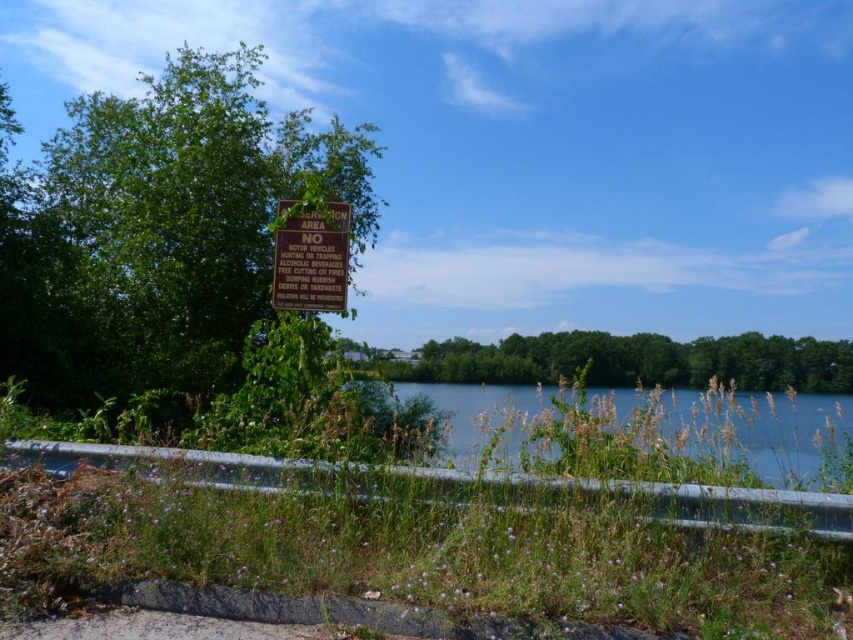
Question: Is green leafy trees at center further to the viewer compared to brown wooden sign at upper center?

Choices:
 (A) yes
 (B) no

Answer: (A)

Question: Can you confirm if green leafy trees at center is bigger than brown wooden sign at upper center?

Choices:
 (A) no
 (B) yes

Answer: (B)

Question: Estimate the real-world distances between objects in this image. Which object is closer to the green leafy tree at upper left?

Choices:
 (A) clear water at center
 (B) brown wooden sign at upper center

Answer: (B)

Question: Is clear water at center to the left of green leafy trees at center from the viewer's perspective?

Choices:
 (A) yes
 (B) no

Answer: (A)

Question: Among these points, which one is nearest to the camera?

Choices:
 (A) (195, 301)
 (B) (767, 467)
 (C) (706, 337)
 (D) (341, 260)

Answer: (B)

Question: Which of the following is the closest to the observer?

Choices:
 (A) clear water at center
 (B) brown wooden sign at upper center

Answer: (A)